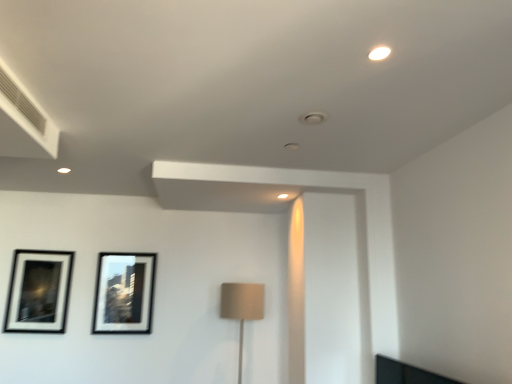
In order to face beige fabric lampshade at center, should I rotate leftwards or rightwards?

You should rotate left by 2.074 degrees.

Measure the distance between point (252, 285) and camera.

Point (252, 285) and camera are 3.63 meters apart from each other.

Image resolution: width=512 pixels, height=384 pixels. I want to click on black matte picture frame at upper left, which is the second picture frame from right to left, so click(39, 291).

Describe the element at coordinates (124, 293) in the screenshot. The height and width of the screenshot is (384, 512). I see `matte black picture frame at center left, acting as the second picture frame starting from the left` at that location.

You are a GUI agent. You are given a task and a screenshot of the screen. Output one action in this format:
    pyautogui.click(x=<x>, y=<y>)
    Task: Click on the beige fabric lampshade at center
    
    Given the screenshot: What is the action you would take?
    pyautogui.click(x=242, y=308)

Based on the photo, is matte black picture frame at center left, positioned as the first picture frame in right-to-left order, placed right next to black matte picture frame at upper left, which is the second picture frame from right to left?

matte black picture frame at center left, positioned as the first picture frame in right-to-left order, and black matte picture frame at upper left, which is the second picture frame from right to left, are clearly separated.

Considering the sizes of matte black picture frame at center left, positioned as the first picture frame in right-to-left order, and black matte picture frame at upper left, positioned as the 1th picture frame in left-to-right order, in the image, is matte black picture frame at center left, positioned as the first picture frame in right-to-left order, wider or thinner than black matte picture frame at upper left, positioned as the 1th picture frame in left-to-right order,?

matte black picture frame at center left, positioned as the first picture frame in right-to-left order, is thinner than black matte picture frame at upper left, positioned as the 1th picture frame in left-to-right order.

Consider the image. From a real-world perspective, is matte black picture frame at center left, positioned as the first picture frame in right-to-left order, on black matte picture frame at upper left, which is the second picture frame from right to left?

Yes.

Is point (111, 332) closer or farther from the camera than point (35, 277)?

Point (111, 332).

Would you say black matte picture frame at upper left, which is the second picture frame from right to left, contains beige fabric lampshade at center?

No.

Is black matte picture frame at upper left, which is the second picture frame from right to left, further to camera compared to beige fabric lampshade at center?

Yes.

This screenshot has height=384, width=512. I want to click on the 2nd picture frame counting from the left side of the beige fabric lampshade at center, so coord(39,291).

From a real-world perspective, is black matte picture frame at upper left, which is the second picture frame from right to left, below beige fabric lampshade at center?

No, from a real-world perspective, black matte picture frame at upper left, which is the second picture frame from right to left, is not beneath beige fabric lampshade at center.

From a real-world perspective, between black matte picture frame at upper left, which is the second picture frame from right to left, and matte black picture frame at center left, acting as the second picture frame starting from the left, who is vertically lower?

black matte picture frame at upper left, which is the second picture frame from right to left.

Visually, is black matte picture frame at upper left, which is the second picture frame from right to left, positioned to the left or to the right of matte black picture frame at center left, acting as the second picture frame starting from the left?

In the image, black matte picture frame at upper left, which is the second picture frame from right to left, appears on the left side of matte black picture frame at center left, acting as the second picture frame starting from the left.

Which point is more forward, (18, 284) or (102, 279)?

Positioned in front is point (18, 284).

Looking at this image, is the surface of black matte picture frame at upper left, which is the second picture frame from right to left, in direct contact with matte black picture frame at center left, acting as the second picture frame starting from the left?

black matte picture frame at upper left, which is the second picture frame from right to left, and matte black picture frame at center left, acting as the second picture frame starting from the left, are not in contact.

From the picture: Which point is more distant from viewer, [142,287] or [239,313]?

Positioned behind is point [142,287].

Considering the relative sizes of matte black picture frame at center left, positioned as the first picture frame in right-to-left order, and beige fabric lampshade at center in the image provided, is matte black picture frame at center left, positioned as the first picture frame in right-to-left order, bigger than beige fabric lampshade at center?

No.

Can you tell me how much matte black picture frame at center left, acting as the second picture frame starting from the left, and beige fabric lampshade at center differ in facing direction?

They differ by 0.401 degrees in their facing directions.

Based on the photo, is beige fabric lampshade at center located within matte black picture frame at center left, acting as the second picture frame starting from the left?

No, matte black picture frame at center left, acting as the second picture frame starting from the left, does not contain beige fabric lampshade at center.

Is beige fabric lampshade at center positioned in front of black matte picture frame at upper left, positioned as the 1th picture frame in left-to-right order?

That is True.

From the image's perspective, between beige fabric lampshade at center and black matte picture frame at upper left, positioned as the 1th picture frame in left-to-right order, who is located below?

beige fabric lampshade at center is shown below in the image.

Looking at their sizes, would you say beige fabric lampshade at center is wider or thinner than black matte picture frame at upper left, which is the second picture frame from right to left?

Clearly, beige fabric lampshade at center has more width compared to black matte picture frame at upper left, which is the second picture frame from right to left.

Considering the relative positions of beige fabric lampshade at center and black matte picture frame at upper left, positioned as the 1th picture frame in left-to-right order, in the image provided, is beige fabric lampshade at center to the left of black matte picture frame at upper left, positioned as the 1th picture frame in left-to-right order, from the viewer's perspective?

In fact, beige fabric lampshade at center is to the right of black matte picture frame at upper left, positioned as the 1th picture frame in left-to-right order.

From the picture: Between beige fabric lampshade at center and matte black picture frame at center left, positioned as the first picture frame in right-to-left order, which one has smaller width?

With smaller width is matte black picture frame at center left, positioned as the first picture frame in right-to-left order.

What's the angular difference between beige fabric lampshade at center and matte black picture frame at center left, acting as the second picture frame starting from the left,'s facing directions?

They differ by 0.401 degrees in their facing directions.

Would you say beige fabric lampshade at center is a long distance from matte black picture frame at center left, acting as the second picture frame starting from the left?

No, beige fabric lampshade at center is in close proximity to matte black picture frame at center left, acting as the second picture frame starting from the left.

Is beige fabric lampshade at center aimed at matte black picture frame at center left, positioned as the first picture frame in right-to-left order?

No, beige fabric lampshade at center is not oriented towards matte black picture frame at center left, positioned as the first picture frame in right-to-left order.

Locate an element on the screen. The width and height of the screenshot is (512, 384). picture frame above the matte black picture frame at center left, acting as the second picture frame starting from the left (from the image's perspective) is located at coordinates (39, 291).

You are a GUI agent. You are given a task and a screenshot of the screen. Output one action in this format:
    pyautogui.click(x=<x>, y=<y>)
    Task: Click on the table lamp directly beneath the black matte picture frame at upper left, which is the second picture frame from right to left (from a real-world perspective)
    This screenshot has height=384, width=512.
    Given the screenshot: What is the action you would take?
    pyautogui.click(x=242, y=308)

When comparing their distances from beige fabric lampshade at center, does matte black picture frame at center left, positioned as the first picture frame in right-to-left order, or black matte picture frame at upper left, positioned as the 1th picture frame in left-to-right order, seem closer?

The object closer to beige fabric lampshade at center is matte black picture frame at center left, positioned as the first picture frame in right-to-left order.

Based on their spatial positions, is matte black picture frame at center left, acting as the second picture frame starting from the left, or beige fabric lampshade at center further from black matte picture frame at upper left, positioned as the 1th picture frame in left-to-right order?

beige fabric lampshade at center is positioned further to the anchor black matte picture frame at upper left, positioned as the 1th picture frame in left-to-right order.

Looking at the image, which one is located further to matte black picture frame at center left, acting as the second picture frame starting from the left, beige fabric lampshade at center or black matte picture frame at upper left, which is the second picture frame from right to left?

beige fabric lampshade at center lies further to matte black picture frame at center left, acting as the second picture frame starting from the left, than the other object.

Looking at the image, which one is located further to matte black picture frame at center left, positioned as the first picture frame in right-to-left order, black matte picture frame at upper left, positioned as the 1th picture frame in left-to-right order, or beige fabric lampshade at center?

Among the two, beige fabric lampshade at center is located further to matte black picture frame at center left, positioned as the first picture frame in right-to-left order.

Estimate the real-world distances between objects in this image. Which object is closer to black matte picture frame at upper left, which is the second picture frame from right to left, beige fabric lampshade at center or matte black picture frame at center left, acting as the second picture frame starting from the left?

matte black picture frame at center left, acting as the second picture frame starting from the left.

Based on their spatial positions, is black matte picture frame at upper left, which is the second picture frame from right to left, or matte black picture frame at center left, positioned as the first picture frame in right-to-left order, closer to beige fabric lampshade at center?

Among the two, matte black picture frame at center left, positioned as the first picture frame in right-to-left order, is located nearer to beige fabric lampshade at center.

Where is `picture frame situated between black matte picture frame at upper left, which is the second picture frame from right to left, and beige fabric lampshade at center from left to right`? Image resolution: width=512 pixels, height=384 pixels. picture frame situated between black matte picture frame at upper left, which is the second picture frame from right to left, and beige fabric lampshade at center from left to right is located at coordinates (124, 293).